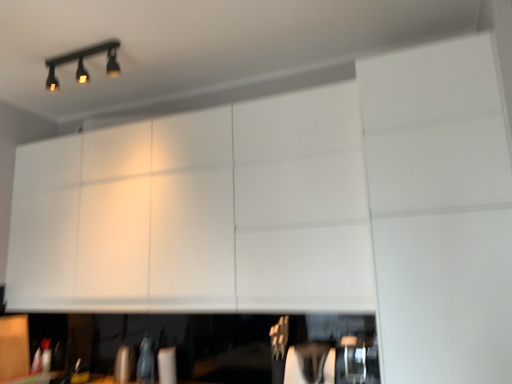
Question: From the image's perspective, is black matte track light at upper left on white matte cabinet at upper center, which is the 1th cabinetry in right-to-left order?

Choices:
 (A) yes
 (B) no

Answer: (A)

Question: From the image's perspective, is black matte track light at upper left located beneath white matte cabinet at upper center, positioned as the first cabinetry in top-to-bottom order?

Choices:
 (A) no
 (B) yes

Answer: (A)

Question: Is black matte track light at upper left thinner than white matte cabinet at upper center, which is the 1th cabinetry in right-to-left order?

Choices:
 (A) yes
 (B) no

Answer: (A)

Question: Is black matte track light at upper left positioned with its back to white matte cabinet at upper center, positioned as the first cabinetry in top-to-bottom order?

Choices:
 (A) yes
 (B) no

Answer: (B)

Question: Does black matte track light at upper left appear on the left side of white matte cabinet at upper center, which is the 1th cabinetry in right-to-left order?

Choices:
 (A) yes
 (B) no

Answer: (A)

Question: Is matte wood cabinet at lower left, which is the 1th cabinetry in left-to-right order, taller or shorter than white matte cabinet at upper center, which is the 1th cabinetry in right-to-left order?

Choices:
 (A) short
 (B) tall

Answer: (A)

Question: From the image's perspective, is matte wood cabinet at lower left, acting as the 2th cabinetry starting from the right, located above or below white matte cabinet at upper center, the second cabinetry when ordered from bottom to top?

Choices:
 (A) below
 (B) above

Answer: (A)

Question: Choose the correct answer: Is matte wood cabinet at lower left, which ranks as the 2th cabinetry in top-to-bottom order, inside white matte cabinet at upper center, positioned as the first cabinetry in top-to-bottom order, or outside it?

Choices:
 (A) inside
 (B) outside

Answer: (B)

Question: Looking at their shapes, would you say matte wood cabinet at lower left, which is counted as the first cabinetry, starting from the bottom, is wider or thinner than white matte cabinet at upper center, positioned as the first cabinetry in top-to-bottom order?

Choices:
 (A) thin
 (B) wide

Answer: (A)

Question: In the image, is white matte cabinet at upper center, the second cabinetry in the left-to-right sequence, on the left side or the right side of black matte track light at upper left?

Choices:
 (A) right
 (B) left

Answer: (A)

Question: Is white matte cabinet at upper center, which is the 1th cabinetry in right-to-left order, in front of or behind black matte track light at upper left in the image?

Choices:
 (A) behind
 (B) front

Answer: (B)

Question: From the image's perspective, relative to black matte track light at upper left, is white matte cabinet at upper center, positioned as the first cabinetry in top-to-bottom order, above or below?

Choices:
 (A) below
 (B) above

Answer: (A)

Question: From their relative heights in the image, would you say white matte cabinet at upper center, positioned as the first cabinetry in top-to-bottom order, is taller or shorter than black matte track light at upper left?

Choices:
 (A) short
 (B) tall

Answer: (B)

Question: In terms of width, does black matte track light at upper left look wider or thinner when compared to matte wood cabinet at lower left, acting as the 2th cabinetry starting from the right?

Choices:
 (A) wide
 (B) thin

Answer: (A)

Question: Is black matte track light at upper left inside the boundaries of matte wood cabinet at lower left, which is counted as the first cabinetry, starting from the bottom, or outside?

Choices:
 (A) outside
 (B) inside

Answer: (A)